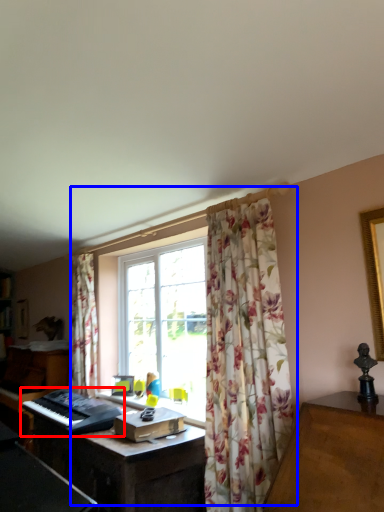
Question: Which object appears farthest to the camera in this image, musical keyboard (highlighted by a red box) or window (highlighted by a blue box)?

Choices:
 (A) musical keyboard
 (B) window

Answer: (A)